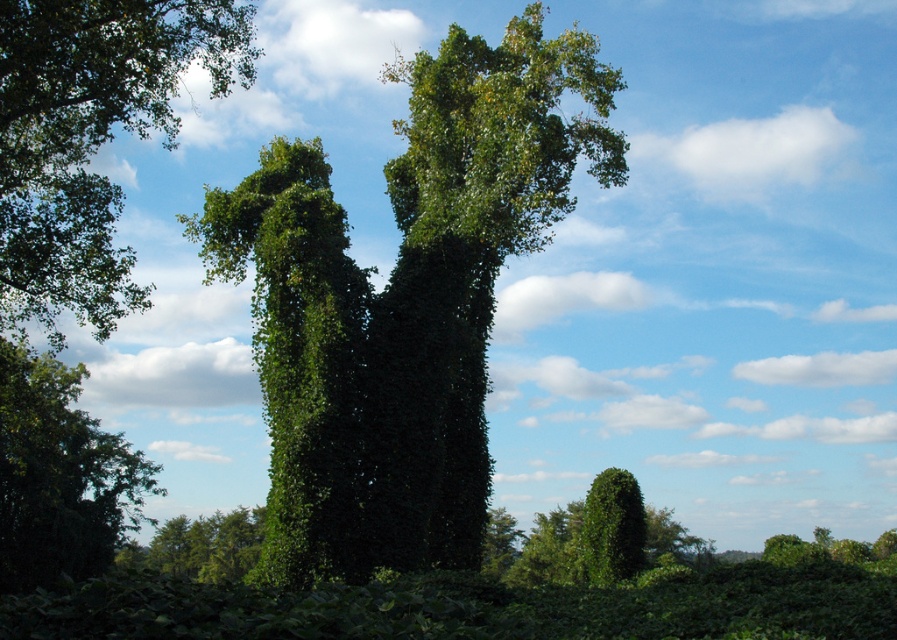
Find the location of a particular element. green leafy tree at upper left is located at coordinates (90, 138).

Which is in front, point (46, 211) or point (105, 499)?

Positioned in front is point (46, 211).

You are a GUI agent. You are given a task and a screenshot of the screen. Output one action in this format:
    pyautogui.click(x=<x>, y=<y>)
    Task: Click on the green leafy tree at upper left
    The image size is (897, 640).
    Given the screenshot: What is the action you would take?
    pyautogui.click(x=90, y=138)

Does green leafy tree at center have a greater height compared to green leafy tree at upper left?

Yes.

Where is `green leafy tree at center`? The height and width of the screenshot is (640, 897). green leafy tree at center is located at coordinates (443, 300).

Does green leafy tree at center appear over green leafy bush at lower left?

Correct, green leafy tree at center is located above green leafy bush at lower left.

Who is more distant from viewer, (356, 403) or (46, 512)?

Point (46, 512)

Locate an element on the screen. The image size is (897, 640). green leafy tree at center is located at coordinates (443, 300).